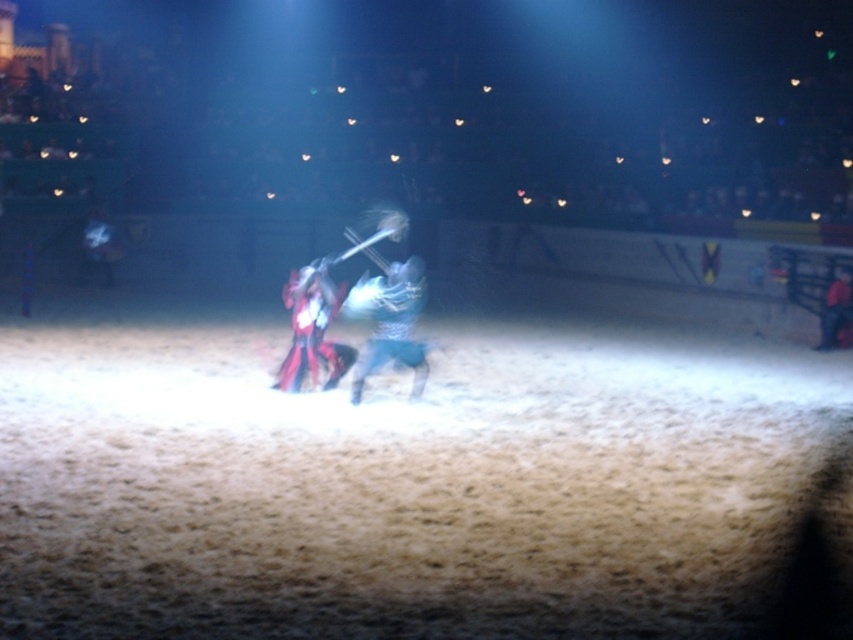
Which is above, metallic blue armor at center or shiny red armor at center?

A: metallic blue armor at center is higher up.

Between metallic blue armor at center and shiny red armor at center, which one is positioned lower?

shiny red armor at center is below.

Measure the distance between point (421,294) and camera.

They are 37.73 feet apart.

Locate an element on the screen. metallic blue armor at center is located at coordinates (389, 321).